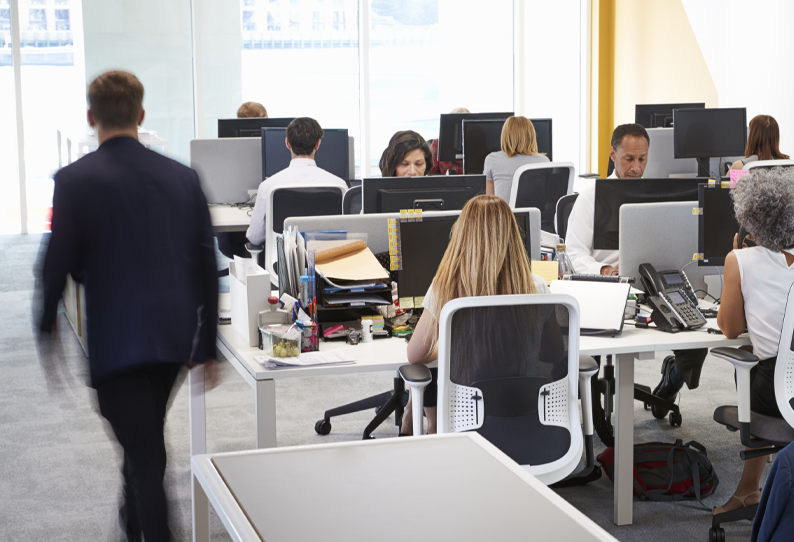
You are a GUI agent. You are given a task and a screenshot of the screen. Output one action in this format:
    pyautogui.click(x=<x>, y=<y>)
    Task: Click on the computer screens
    This screenshot has height=542, width=794.
    Given the screenshot: What is the action you would take?
    pyautogui.click(x=422, y=243), pyautogui.click(x=413, y=195), pyautogui.click(x=268, y=147), pyautogui.click(x=249, y=126), pyautogui.click(x=445, y=131), pyautogui.click(x=471, y=136), pyautogui.click(x=663, y=112), pyautogui.click(x=688, y=126), pyautogui.click(x=703, y=211), pyautogui.click(x=656, y=193)